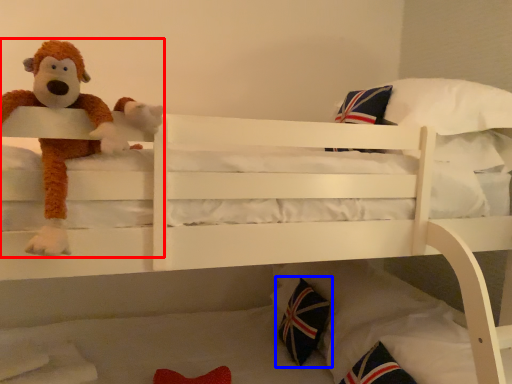
Question: Among these objects, which one is nearest to the camera, toy (highlighted by a red box) or throw pillow (highlighted by a blue box)?

Choices:
 (A) toy
 (B) throw pillow

Answer: (A)